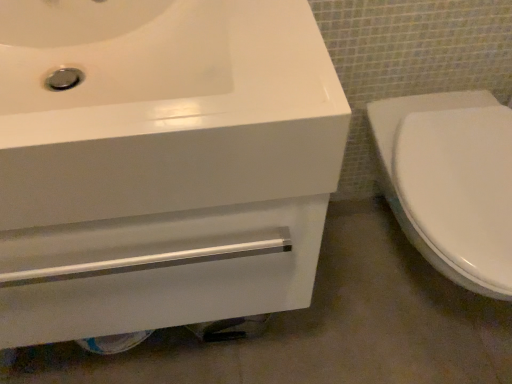
In order to face white glossy toilet at right, should I rotate leftwards or rightwards?

To face it directly, rotate right by 25.043 degrees.

The image size is (512, 384). In order to click on white glossy drawer at lower left in this screenshot , I will do `click(158, 270)`.

This screenshot has height=384, width=512. What do you see at coordinates (161, 163) in the screenshot?
I see `white glossy sink at upper left` at bounding box center [161, 163].

This screenshot has height=384, width=512. I want to click on white glossy toilet at right, so click(451, 182).

Does white glossy toilet at right turn towards white glossy sink at upper left?

No, white glossy toilet at right is not aimed at white glossy sink at upper left.

Which object is wider, white glossy toilet at right or white glossy sink at upper left?

white glossy toilet at right is wider.

Between white glossy toilet at right and white glossy sink at upper left, which one has more height?

Standing taller between the two is white glossy toilet at right.

Can you tell me how much white glossy drawer at lower left and white glossy toilet at right differ in facing direction?

The facing directions of white glossy drawer at lower left and white glossy toilet at right are 1.56 degrees apart.

Considering the relative sizes of white glossy drawer at lower left and white glossy toilet at right in the image provided, is white glossy drawer at lower left bigger than white glossy toilet at right?

Actually, white glossy drawer at lower left might be smaller than white glossy toilet at right.

From a real-world perspective, is white glossy drawer at lower left above or below white glossy toilet at right?

white glossy drawer at lower left is below white glossy toilet at right.

Between white glossy drawer at lower left and white glossy toilet at right, which one has less height?

white glossy drawer at lower left.

How far apart are white glossy drawer at lower left and white glossy sink at upper left?

2.51 inches.

Is white glossy drawer at lower left bigger than white glossy sink at upper left?

Incorrect, white glossy drawer at lower left is not larger than white glossy sink at upper left.

Looking at this image, is white glossy drawer at lower left surrounding white glossy sink at upper left?

No, white glossy sink at upper left is located outside of white glossy drawer at lower left.

From a real-world perspective, does white glossy drawer at lower left stand above white glossy sink at upper left?

No, from a real-world perspective, white glossy drawer at lower left is not above white glossy sink at upper left.

Considering the sizes of objects white glossy sink at upper left and white glossy drawer at lower left in the image provided, who is bigger, white glossy sink at upper left or white glossy drawer at lower left?

white glossy sink at upper left is bigger.

Considering the points (68, 53) and (307, 201), which point is in front, point (68, 53) or point (307, 201)?

The point (307, 201) is closer to the camera.

Find the location of a particular element. The image size is (512, 384). drawer located on the right of white glossy sink at upper left is located at coordinates (158, 270).

What are the coordinates of `drawer lying below the white glossy toilet at right (from the image's perspective)` in the screenshot? It's located at (158, 270).

Are white glossy toilet at right and white glossy drawer at lower left far apart?

No, white glossy toilet at right is not far away from white glossy drawer at lower left.

Does white glossy toilet at right contain white glossy drawer at lower left?

No, white glossy drawer at lower left is not a part of white glossy toilet at right.

From the picture: Is white glossy toilet at right looking in the opposite direction of white glossy drawer at lower left?

No, white glossy toilet at right is not facing the opposite direction of white glossy drawer at lower left.

Is white glossy sink at upper left aimed at white glossy toilet at right?

No, white glossy sink at upper left is not turned towards white glossy toilet at right.

Considering the relative sizes of white glossy sink at upper left and white glossy toilet at right in the image provided, is white glossy sink at upper left bigger than white glossy toilet at right?

Correct, white glossy sink at upper left is larger in size than white glossy toilet at right.

From a real-world perspective, is white glossy sink at upper left physically located above or below white glossy toilet at right?

Clearly, from a real-world perspective, white glossy sink at upper left is above white glossy toilet at right.

Does white glossy sink at upper left come behind white glossy toilet at right?

No, it is in front of white glossy toilet at right.

This screenshot has height=384, width=512. What are the coordinates of `toilet below the white glossy sink at upper left (from a real-world perspective)` in the screenshot? It's located at (451, 182).

At what (x,y) coordinates should I click in order to perform the action: click on toilet that appears above the white glossy drawer at lower left (from a real-world perspective). Please return your answer as a coordinate pair (x, y). This screenshot has height=384, width=512. Looking at the image, I should click on (451, 182).

Estimate the real-world distances between objects in this image. Which object is closer to white glossy drawer at lower left, white glossy sink at upper left or white glossy toilet at right?

white glossy sink at upper left is closer to white glossy drawer at lower left.

Which object lies further to the anchor point white glossy toilet at right, white glossy drawer at lower left or white glossy sink at upper left?

The object further to white glossy toilet at right is white glossy sink at upper left.

When comparing their distances from white glossy drawer at lower left, does white glossy toilet at right or white glossy sink at upper left seem further?

white glossy toilet at right is further to white glossy drawer at lower left.

When comparing their distances from white glossy toilet at right, does white glossy sink at upper left or white glossy drawer at lower left seem closer?

white glossy drawer at lower left is closer to white glossy toilet at right.

Estimate the real-world distances between objects in this image. Which object is further from white glossy sink at upper left, white glossy toilet at right or white glossy drawer at lower left?

Based on the image, white glossy toilet at right appears to be further to white glossy sink at upper left.

From the image, which object appears to be farther from white glossy sink at upper left, white glossy drawer at lower left or white glossy toilet at right?

The object further to white glossy sink at upper left is white glossy toilet at right.

Locate an element on the screen. drawer located between white glossy sink at upper left and white glossy toilet at right in the left-right direction is located at coordinates (158, 270).